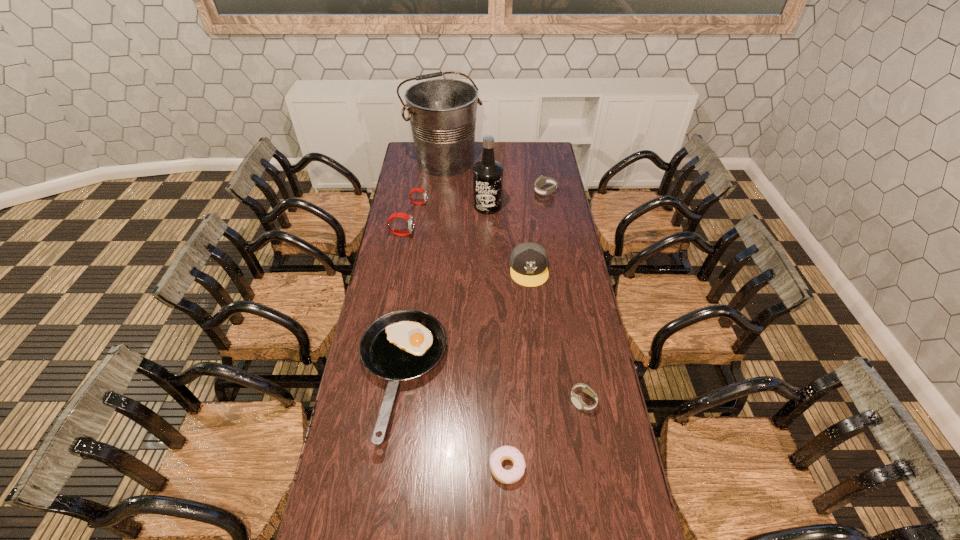
Find the location of `object located at the far left corner`. object located at the far left corner is located at coordinates (414, 539).

In the image, there is a desktop. Where is `free space at the left edge`? Image resolution: width=960 pixels, height=540 pixels. free space at the left edge is located at coordinates (415, 190).

Identify the location of object identified as the closest to the farthest object. This screenshot has height=540, width=960. (414, 539).

At what (x,y) coordinates should I click in order to perform the action: click on the third closest object to the liquor. Please return your answer as a coordinate pair (x, y). This screenshot has width=960, height=540. Looking at the image, I should click on point(414,539).

Where is `the second closest watch to the smaller red watch`? the second closest watch to the smaller red watch is located at coordinates (414, 539).

Where is `watch that is the second closest one to the black liquor`? The image size is (960, 540). watch that is the second closest one to the black liquor is located at coordinates (414, 539).

Find the location of `vacant space that satisfies the following two spatial constraints: 1. on the back side of the frying pan; 2. on the left side of the farthest object`. vacant space that satisfies the following two spatial constraints: 1. on the back side of the frying pan; 2. on the left side of the farthest object is located at coordinates (432, 160).

Identify the location of free location that satisfies the following two spatial constraints: 1. on the face of the frying pan; 2. on the left side of the fifth farthest object. This screenshot has width=960, height=540. (374, 377).

Where is `vacant space that satisfies the following two spatial constraints: 1. on the face of the frying pan; 2. on the right side of the nearer red watch`? This screenshot has height=540, width=960. vacant space that satisfies the following two spatial constraints: 1. on the face of the frying pan; 2. on the right side of the nearer red watch is located at coordinates (374, 377).